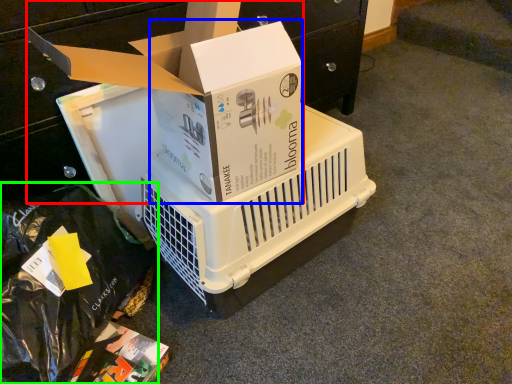
Question: Estimate the real-world distances between objects in this image. Which object is farther from box (highlighted by a red box), box (highlighted by a blue box) or garbage (highlighted by a green box)?

Choices:
 (A) box
 (B) garbage

Answer: (B)